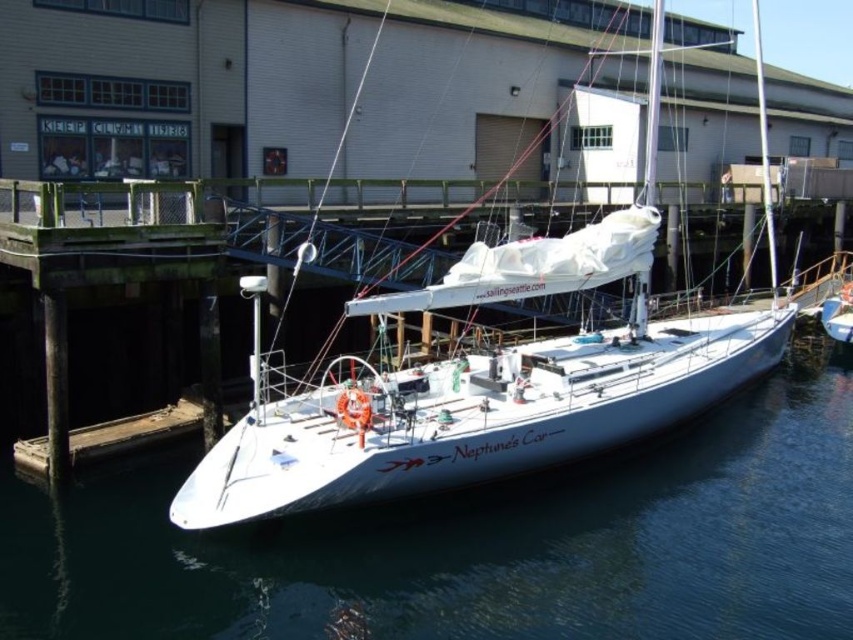
Is point (840, 502) positioned before point (689, 205)?

Yes, point (840, 502) is closer to viewer.

Which is more to the left, clear water at center or wooden dock at lower left?

clear water at center is more to the left.

Which is in front, point (561, 609) or point (80, 276)?

Point (561, 609) is in front.

Identify the location of clear water at center. This screenshot has width=853, height=640. (476, 545).

Can you confirm if clear water at center is wider than white glossy sailboat at center?

Incorrect, clear water at center's width does not surpass white glossy sailboat at center's.

Which of these two, clear water at center or white glossy sailboat at center, stands taller?

Standing taller between the two is white glossy sailboat at center.

Is point (415, 627) less distant than point (635, 252)?

That is True.

At what (x,y) coordinates should I click in order to perform the action: click on clear water at center. Please return your answer as a coordinate pair (x, y). The image size is (853, 640). Looking at the image, I should click on (476, 545).

Does white glossy sailboat at center have a lesser height compared to wooden dock at lower left?

No.

Is white glossy sailboat at center above wooden dock at lower left?

Indeed, white glossy sailboat at center is positioned over wooden dock at lower left.

This screenshot has height=640, width=853. What do you see at coordinates (488, 378) in the screenshot?
I see `white glossy sailboat at center` at bounding box center [488, 378].

This screenshot has height=640, width=853. Identify the location of white glossy sailboat at center. pos(488,378).